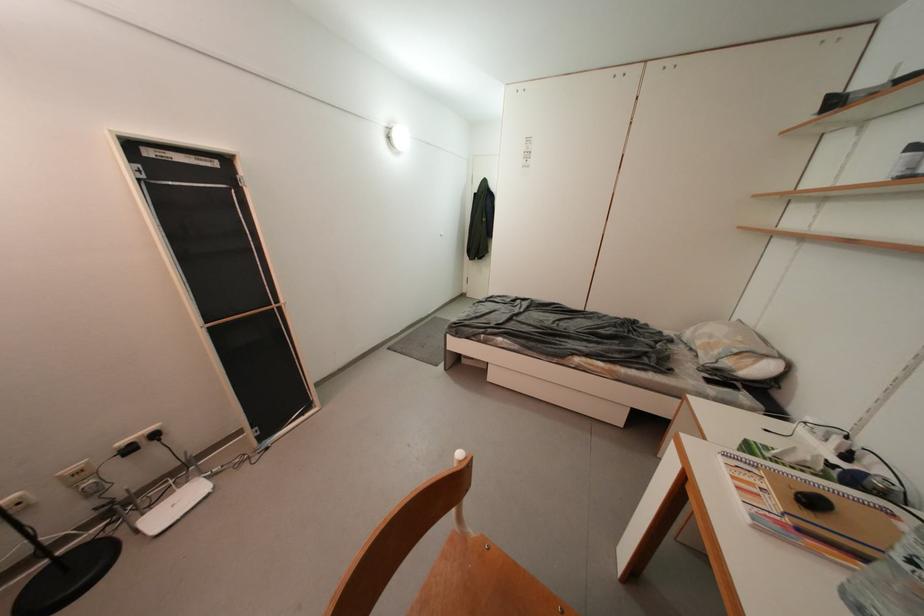
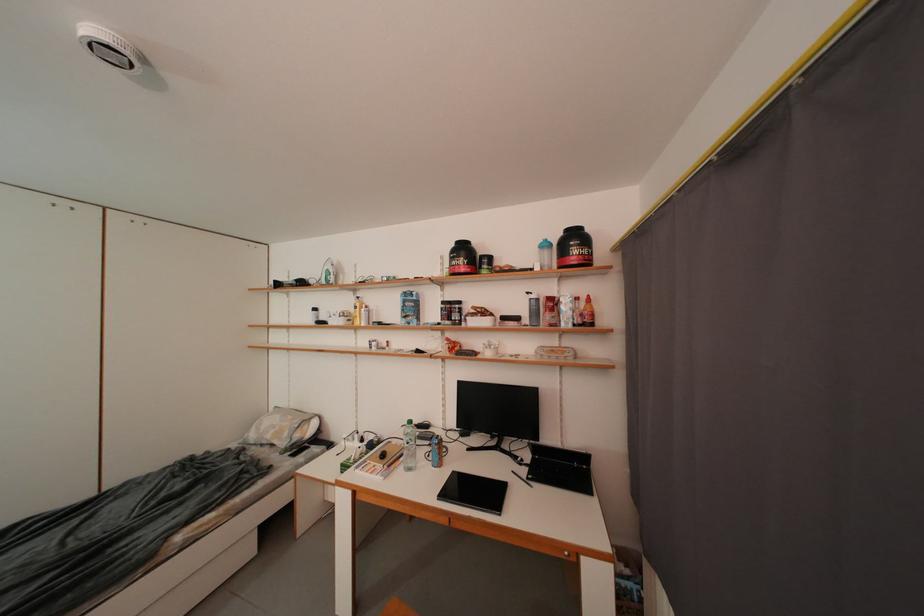
Locate, in the second image, the point that corresponds to [723,355] in the first image.

(294, 438)